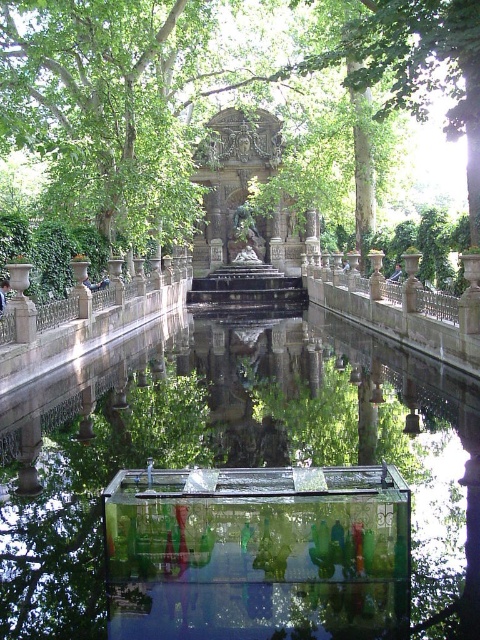
You are a drone operator tasked with capturing aerial footage of the fountain and the surrounding area. The drone has a maximum flight range of 50 meters from its starting position. If you position the drone at the transparent glass water at center, will you be able to capture the green leafy tree at center in your footage without exceeding the drone range?

The distance between transparent glass water at center and green leafy tree at center is 48.50 meters. Since the drone has a maximum range of 50 meters, it can reach the green leafy tree at center within the allowed distance. Therefore, the drone can capture the green leafy tree at center without exceeding its range.

You are standing in the park and notice the transparent glass water at center and the green leafy tree at center. Which object is directly above the other?

The green leafy tree at center is directly above the transparent glass water at center because the water is positioned under the tree.